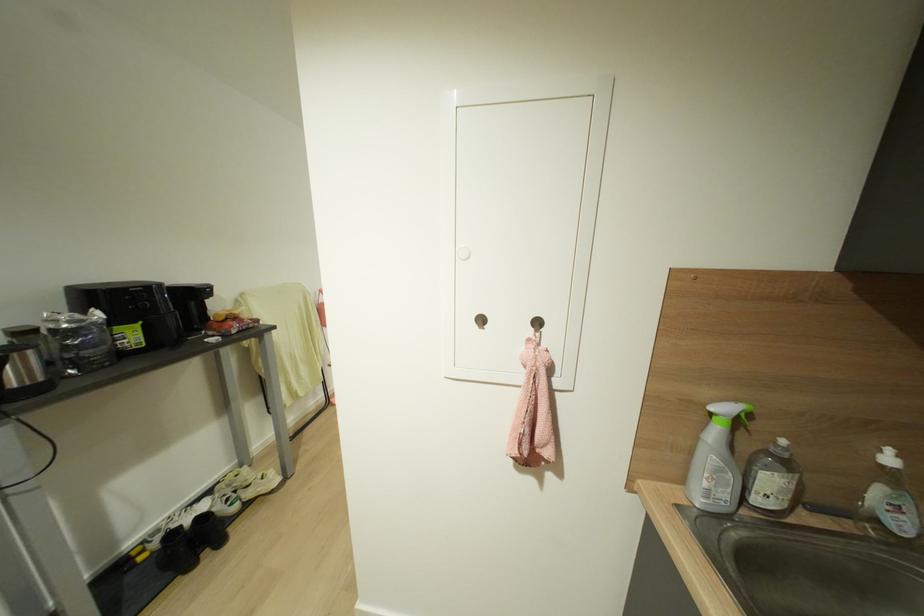
Where is `green spray trigger`? The width and height of the screenshot is (924, 616). green spray trigger is located at coordinates (748, 421).